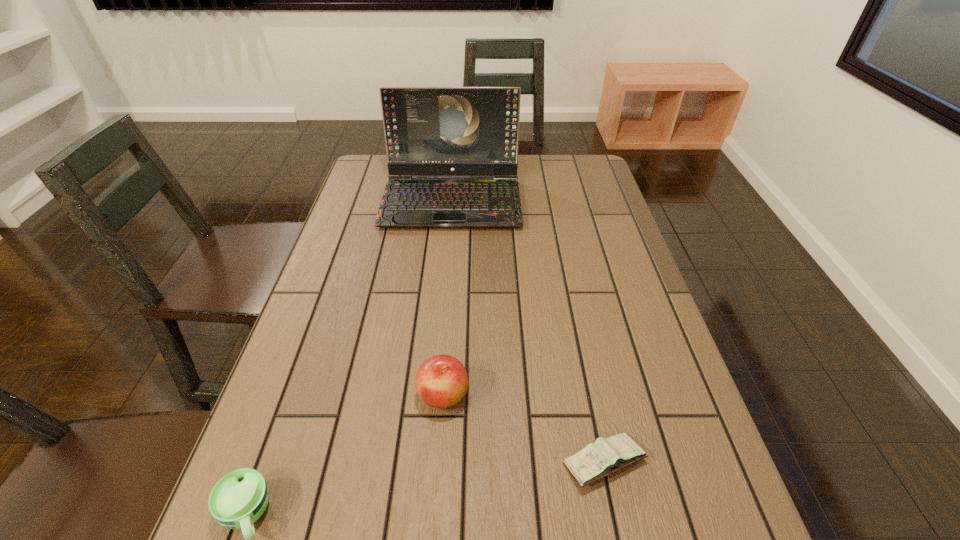
The height and width of the screenshot is (540, 960). What are the coordinates of `free space between the farthest object and the third nearest object` in the screenshot? It's located at (447, 298).

Find the location of a particular element. Image resolution: width=960 pixels, height=540 pixels. vacant area between the farthest object and the shortest object is located at coordinates (528, 331).

Locate an element on the screen. blank region between the shortest object and the laptop computer is located at coordinates (528, 331).

At what (x,y) coordinates should I click in order to perform the action: click on free space between the shortest object and the second farthest object. Please return your answer as a coordinate pair (x, y). Looking at the image, I should click on (523, 428).

You are a GUI agent. You are given a task and a screenshot of the screen. Output one action in this format:
    pyautogui.click(x=<x>, y=<y>)
    Task: Click on the object identified as the second closest to the leftmost object
    This screenshot has height=540, width=960.
    Given the screenshot: What is the action you would take?
    pyautogui.click(x=597, y=460)

This screenshot has height=540, width=960. I want to click on object that is the closest to the tallest object, so click(441, 381).

At what (x,y) coordinates should I click in order to perform the action: click on vacant space that satisfies the following two spatial constraints: 1. on the front side of the diary; 2. on the left side of the third nearest object. Please return your answer as a coordinate pair (x, y). Looking at the image, I should click on tap(439, 462).

Image resolution: width=960 pixels, height=540 pixels. What are the coordinates of `free point that satisfies the following two spatial constraints: 1. on the screen of the third nearest object; 2. on the right side of the laptop computer` in the screenshot? It's located at (435, 395).

You are a GUI agent. You are given a task and a screenshot of the screen. Output one action in this format:
    pyautogui.click(x=<x>, y=<y>)
    Task: Click on the vacant region that satisfies the following two spatial constraints: 1. on the screen of the farthest object; 2. on the right side of the third nearest object
    
    Given the screenshot: What is the action you would take?
    pyautogui.click(x=435, y=395)